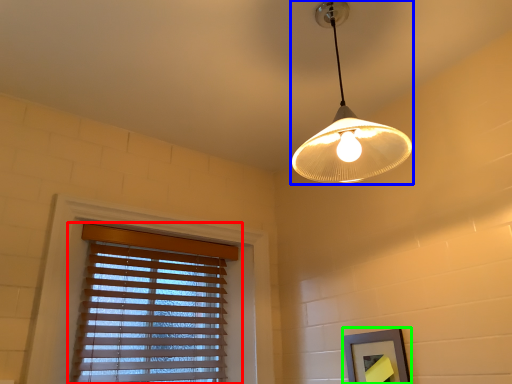
Question: Which is nearer to the window blind (highlighted by a red box)? lamp (highlighted by a blue box) or picture frame (highlighted by a green box).

Choices:
 (A) lamp
 (B) picture frame

Answer: (B)